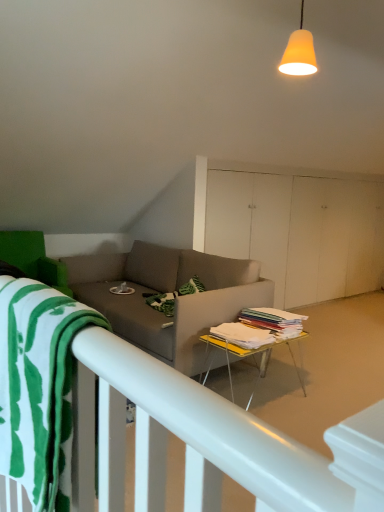
Question: Is yellow plastic table at center not inside white matte bed frame at lower left?

Choices:
 (A) no
 (B) yes

Answer: (B)

Question: Does yellow plastic table at center have a larger size compared to white matte bed frame at lower left?

Choices:
 (A) yes
 (B) no

Answer: (B)

Question: Does yellow plastic table at center have a lesser width compared to white matte bed frame at lower left?

Choices:
 (A) no
 (B) yes

Answer: (B)

Question: Is yellow plastic table at center further to the viewer compared to white matte bed frame at lower left?

Choices:
 (A) yes
 (B) no

Answer: (A)

Question: Considering the relative sizes of yellow plastic table at center and white matte bed frame at lower left in the image provided, is yellow plastic table at center smaller than white matte bed frame at lower left?

Choices:
 (A) no
 (B) yes

Answer: (B)

Question: From the image's perspective, is yellow plastic table at center over white matte bed frame at lower left?

Choices:
 (A) no
 (B) yes

Answer: (B)

Question: Is orange matte lampshade at upper center shorter than yellow plastic table at center?

Choices:
 (A) no
 (B) yes

Answer: (B)

Question: Considering the relative sizes of orange matte lampshade at upper center and yellow plastic table at center in the image provided, is orange matte lampshade at upper center bigger than yellow plastic table at center?

Choices:
 (A) no
 (B) yes

Answer: (A)

Question: Is orange matte lampshade at upper center aimed at yellow plastic table at center?

Choices:
 (A) no
 (B) yes

Answer: (A)

Question: Can you confirm if orange matte lampshade at upper center is positioned to the left of yellow plastic table at center?

Choices:
 (A) yes
 (B) no

Answer: (B)

Question: From a real-world perspective, does orange matte lampshade at upper center sit lower than yellow plastic table at center?

Choices:
 (A) yes
 (B) no

Answer: (B)

Question: Is yellow plastic table at center at the back of orange matte lampshade at upper center?

Choices:
 (A) yes
 (B) no

Answer: (B)

Question: Is white matte bed frame at lower left further to the viewer compared to yellow plastic table at center?

Choices:
 (A) yes
 (B) no

Answer: (B)